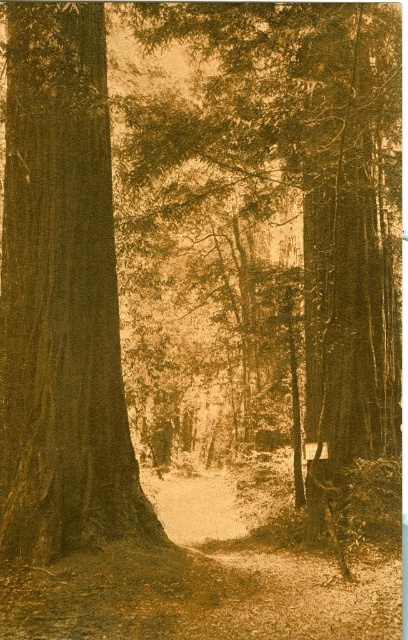
Image resolution: width=408 pixels, height=640 pixels. What do you see at coordinates (299, 176) in the screenshot?
I see `smooth brown tree trunk at center` at bounding box center [299, 176].

Locate an element on the screen. The image size is (408, 640). smooth brown tree trunk at center is located at coordinates (299, 176).

Identify the location of smooth brown tree trunk at center. (299, 176).